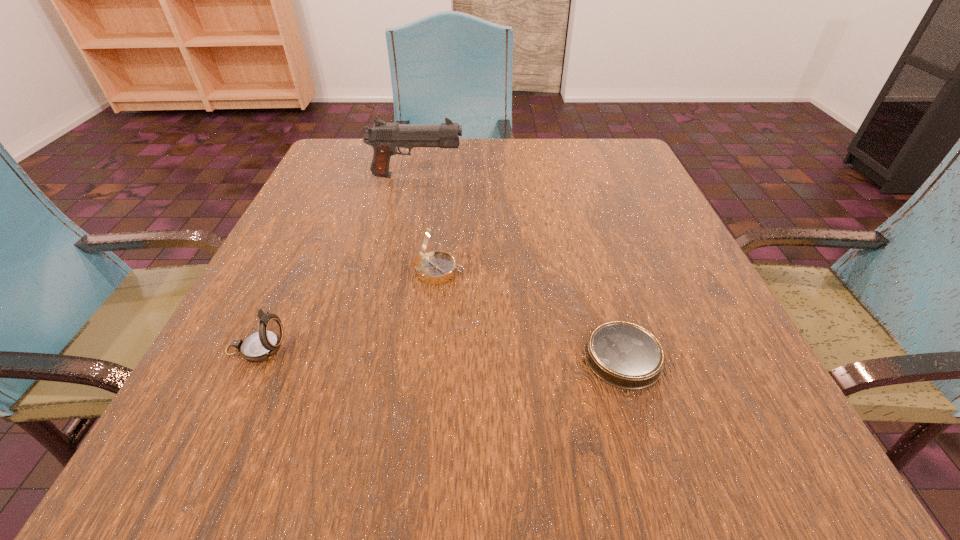
The width and height of the screenshot is (960, 540). I want to click on vacant region between the leftmost compass and the farthest object, so click(x=336, y=262).

Image resolution: width=960 pixels, height=540 pixels. In order to click on object that stands as the third closest to the shortest compass in this screenshot , I will do `click(384, 137)`.

At what (x,y) coordinates should I click in order to perform the action: click on object that ranks as the second closest to the farthest compass. Please return your answer as a coordinate pair (x, y). This screenshot has width=960, height=540. Looking at the image, I should click on (624, 355).

Where is `compass object that ranks as the third closest to the tallest object`? This screenshot has height=540, width=960. compass object that ranks as the third closest to the tallest object is located at coordinates click(x=624, y=355).

Find the location of a particular element. This screenshot has width=960, height=540. compass that stands as the second closest to the shortest object is located at coordinates pos(262,345).

Where is `vacant space that satisfies the following two spatial constraints: 1. with the dial facing the shortest compass; 2. on the left side of the farthest compass`? This screenshot has width=960, height=540. vacant space that satisfies the following two spatial constraints: 1. with the dial facing the shortest compass; 2. on the left side of the farthest compass is located at coordinates (430, 357).

Find the location of a particular element. blank space that satisfies the following two spatial constraints: 1. on the face of the leftmost compass; 2. on the right side of the rightmost compass is located at coordinates (252, 357).

I want to click on free region that satisfies the following two spatial constraints: 1. on the back side of the shortest object; 2. in the direction the gun is aimed, so click(x=568, y=176).

Locate an element on the screen. This screenshot has height=540, width=960. vacant area that satisfies the following two spatial constraints: 1. with the dial facing the second compass from left to right; 2. on the right side of the rightmost object is located at coordinates (430, 357).

Identify the location of free space in the image that satisfies the following two spatial constraints: 1. in the direction the farthest object is aimed; 2. on the left side of the rightmost compass. (377, 357).